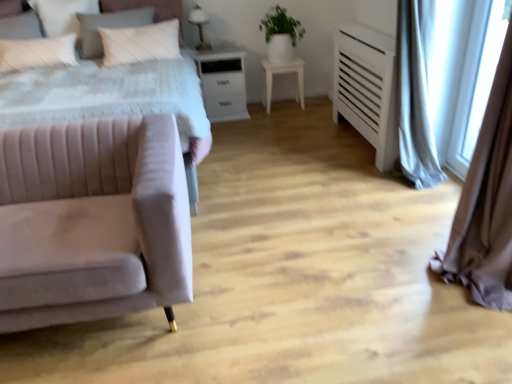
Where is `vacant space underneath light gray fabric curtain at right (from a real-world perspective)`? This screenshot has height=384, width=512. vacant space underneath light gray fabric curtain at right (from a real-world perspective) is located at coordinates (440, 201).